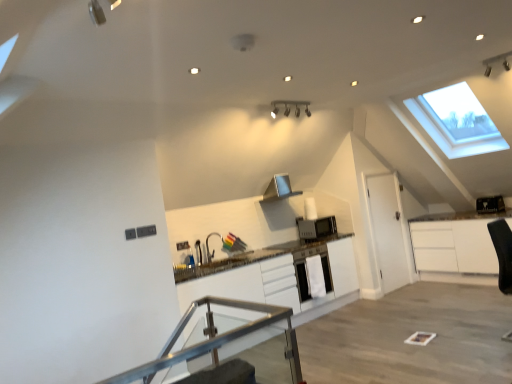
Image resolution: width=512 pixels, height=384 pixels. What are the coordinates of `free space to the back side of black leather swivel chair at lower right` in the screenshot? It's located at (487, 319).